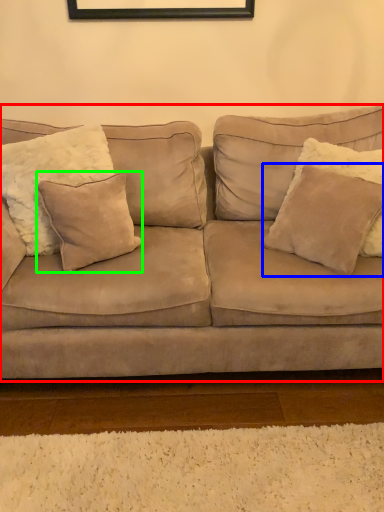
Question: Considering the real-world distances, which object is farthest from studio couch (highlighted by a red box)? pillow (highlighted by a blue box) or pillow (highlighted by a green box)?

Choices:
 (A) pillow
 (B) pillow

Answer: (A)